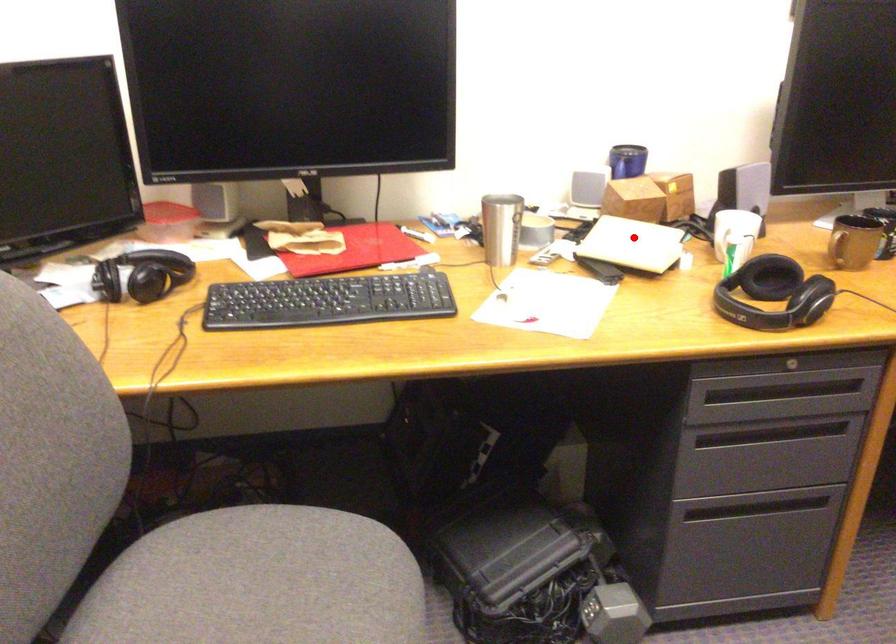
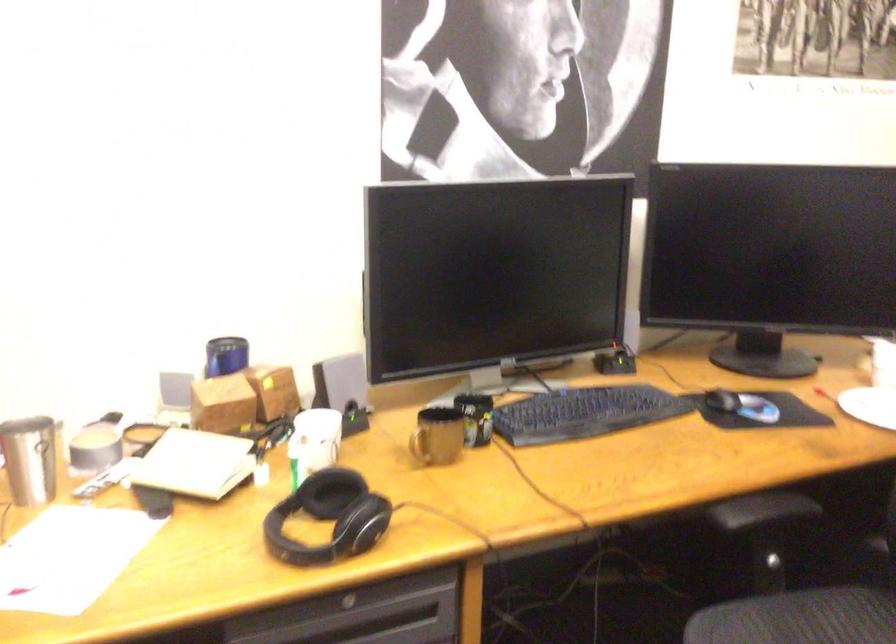
The point at the highlighted location is marked in the first image. Where is the corresponding point in the second image?

(194, 464)